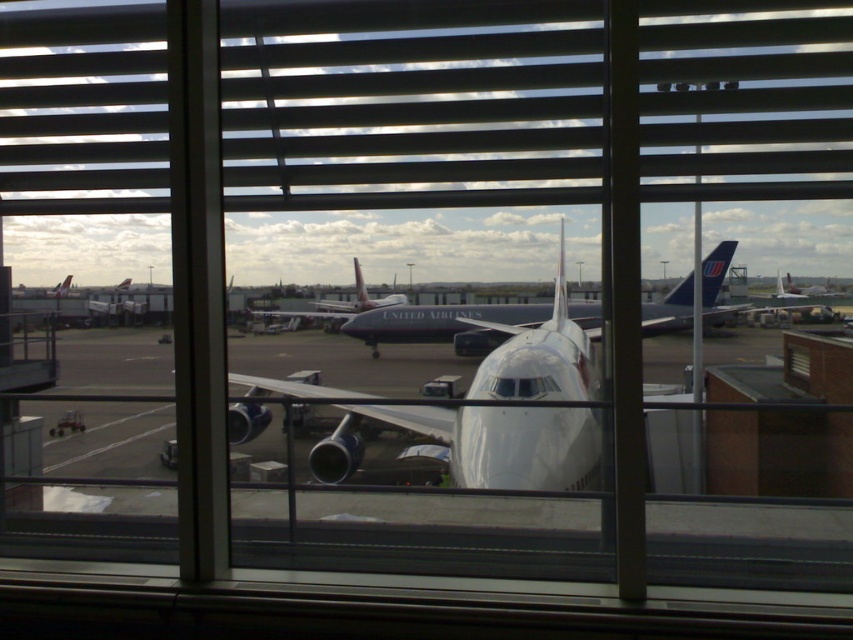
Can you confirm if white glossy airplane at center is positioned to the right of white matte airplane at center?

No, white glossy airplane at center is not to the right of white matte airplane at center.

Between point (323, 474) and point (490, 349), which one is positioned in front?

Point (323, 474) is in front.

Identify the location of white glossy airplane at center. (479, 444).

Can you confirm if white glossy airplane at center is bigger than matte white airplane at center?

Correct, white glossy airplane at center is larger in size than matte white airplane at center.

Which is in front, point (350, 403) or point (340, 308)?

Point (350, 403)

Between point (256, 432) and point (381, 305), which one is positioned in front?

Point (256, 432) is in front.

Locate an element on the screen. white glossy airplane at center is located at coordinates (479, 444).

Which of these two, smooth plastic blinds at center or white matte airplane at center, stands shorter?

With less height is smooth plastic blinds at center.

Which is more to the right, smooth plastic blinds at center or white matte airplane at center?

Positioned to the right is white matte airplane at center.

Between point (683, 115) and point (381, 324), which one is positioned behind?

Point (381, 324)

Find the location of a particular element. smooth plastic blinds at center is located at coordinates (415, 125).